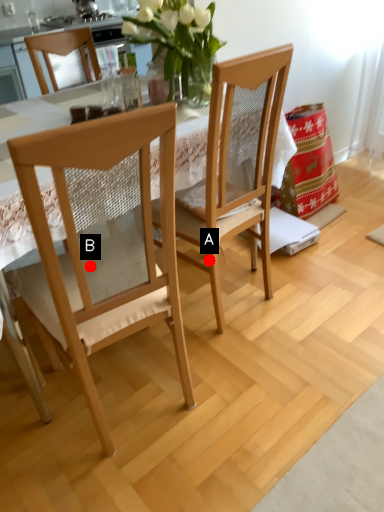
Question: Two points are circled on the image, labeled by A and B beside each circle. Which point appears closest to the camera in this image?

Choices:
 (A) A is closer
 (B) B is closer

Answer: (B)